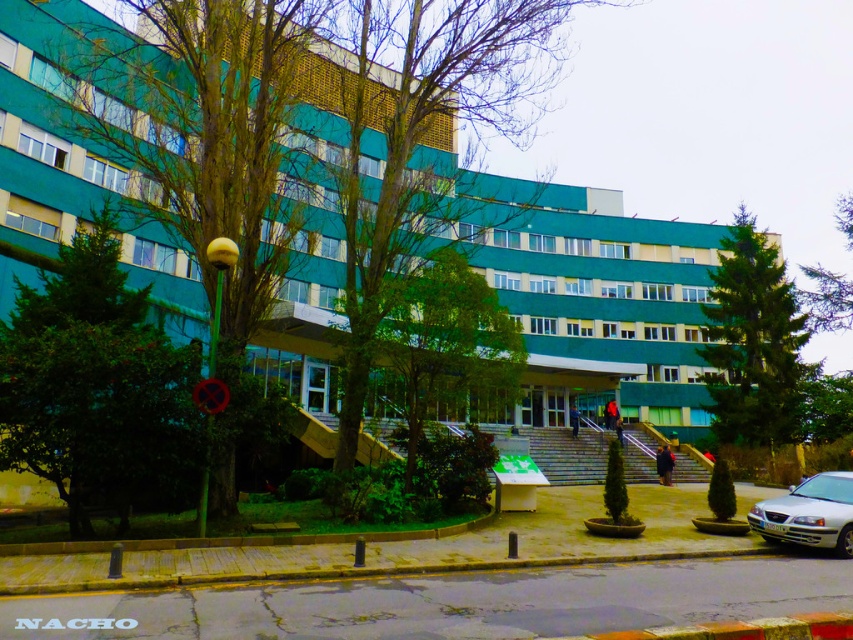
Question: Is green glass building at center closer to camera compared to silver metallic car at lower right?

Choices:
 (A) yes
 (B) no

Answer: (B)

Question: Which point is farther from the camera taking this photo?

Choices:
 (A) (683, 420)
 (B) (793, 536)

Answer: (A)

Question: Is green glass building at center behind silver metallic car at lower right?

Choices:
 (A) no
 (B) yes

Answer: (B)

Question: Is green glass building at center smaller than silver metallic car at lower right?

Choices:
 (A) no
 (B) yes

Answer: (A)